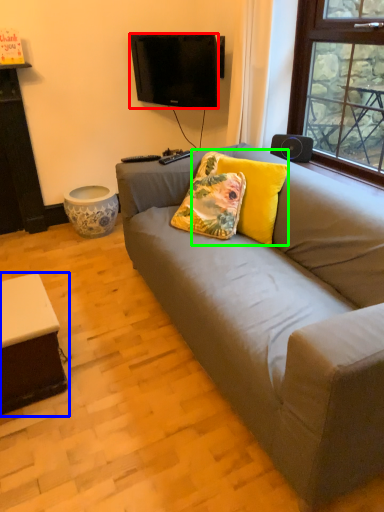
Question: Which object is the closest to the television (highlighted by a red box)? Choose among these: table (highlighted by a blue box) or pillow (highlighted by a green box).

Choices:
 (A) table
 (B) pillow

Answer: (B)